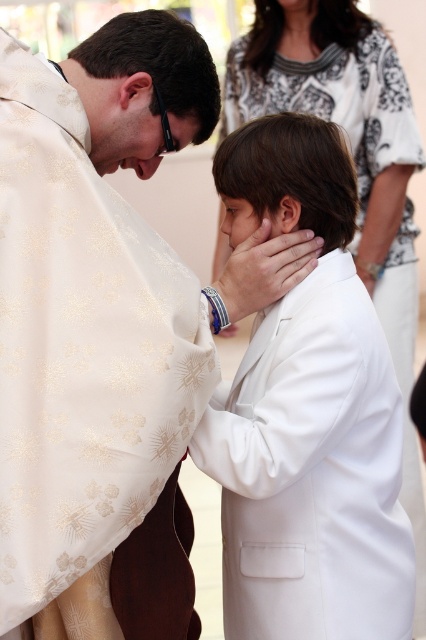
Question: In this image, where is white satin suit at center located relative to white matte hand at center?

Choices:
 (A) left
 (B) right

Answer: (B)

Question: Does white textured robe at left appear on the right side of white satin suit at center?

Choices:
 (A) yes
 (B) no

Answer: (B)

Question: Does white textured robe at left appear on the left side of white satin suit at center?

Choices:
 (A) yes
 (B) no

Answer: (A)

Question: Which point is farther from the camera taking this photo?

Choices:
 (A) (348, 493)
 (B) (17, 278)
 (C) (121, 147)
 (D) (259, 269)

Answer: (D)

Question: Which point is farther to the camera?

Choices:
 (A) matte gold face at center
 (B) brown matte skin at center

Answer: (B)

Question: Among these objects, which one is nearest to the camera?

Choices:
 (A) white textured robe at left
 (B) white matte hand at center

Answer: (A)